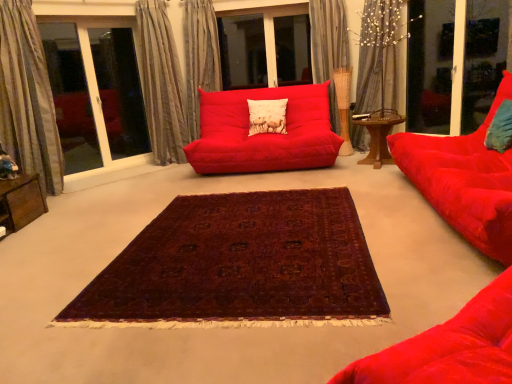
Locate an element on the screen. The height and width of the screenshot is (384, 512). vacant area that lies between wooden at left, which ranks as the second table in back-to-front order, and deep burgundy woven rug at center is located at coordinates (68, 242).